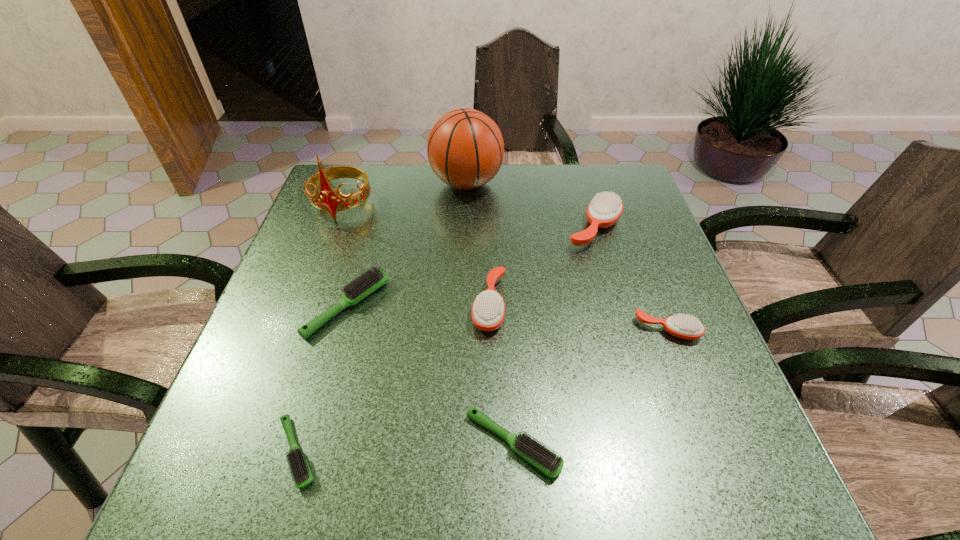
The width and height of the screenshot is (960, 540). In order to click on vacant space that is in between the basketball and the farthest orange hairbrush in this screenshot , I will do `click(531, 206)`.

Locate an element on the screen. This screenshot has height=540, width=960. vacant area that lies between the fourth tallest object and the smallest orange hairbrush is located at coordinates (579, 317).

Identify which object is located as the nearest to the smallest orange hairbrush. Please provide its 2D coordinates. Your answer should be formatted as a tuple, i.e. [(x, y)], where the tuple contains the x and y coordinates of a point satisfying the conditions above.

[(605, 209)]

Where is `object that is the third closest to the leftmost orange hairbrush`? object that is the third closest to the leftmost orange hairbrush is located at coordinates (362, 286).

Locate which hairbrush is the closest to the farthest light hairbrush. Please provide its 2D coordinates. Your answer should be formatted as a tuple, i.e. [(x, y)], where the tuple contains the x and y coordinates of a point satisfying the conditions above.

[(302, 476)]

Identify which hairbrush is the closest to the smallest orange hairbrush. Please provide its 2D coordinates. Your answer should be formatted as a tuple, i.e. [(x, y)], where the tuple contains the x and y coordinates of a point satisfying the conditions above.

[(605, 209)]

Identify which orange hairbrush is the second nearest to the biggest light hairbrush. Please provide its 2D coordinates. Your answer should be formatted as a tuple, i.e. [(x, y)], where the tuple contains the x and y coordinates of a point satisfying the conditions above.

[(605, 209)]

Locate an element on the screen. orange hairbrush that is the closest to the basketball is located at coordinates (605, 209).

The image size is (960, 540). What are the coordinates of `light hairbrush that stands as the second closest to the fifth tallest hairbrush` in the screenshot? It's located at (302, 476).

Point out which light hairbrush is positioned as the second nearest to the farthest light hairbrush. Please provide its 2D coordinates. Your answer should be formatted as a tuple, i.e. [(x, y)], where the tuple contains the x and y coordinates of a point satisfying the conditions above.

[(538, 455)]